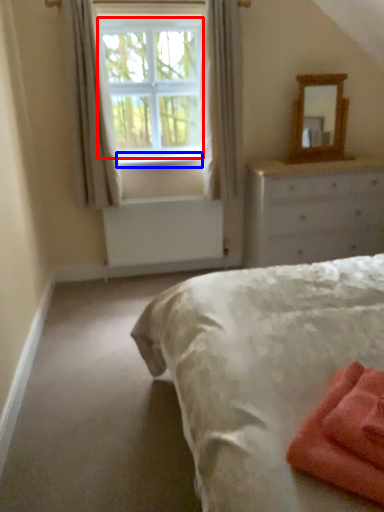
Question: Which of the following is the closest to the observer, window screen (highlighted by a red box) or window sill (highlighted by a blue box)?

Choices:
 (A) window screen
 (B) window sill

Answer: (A)